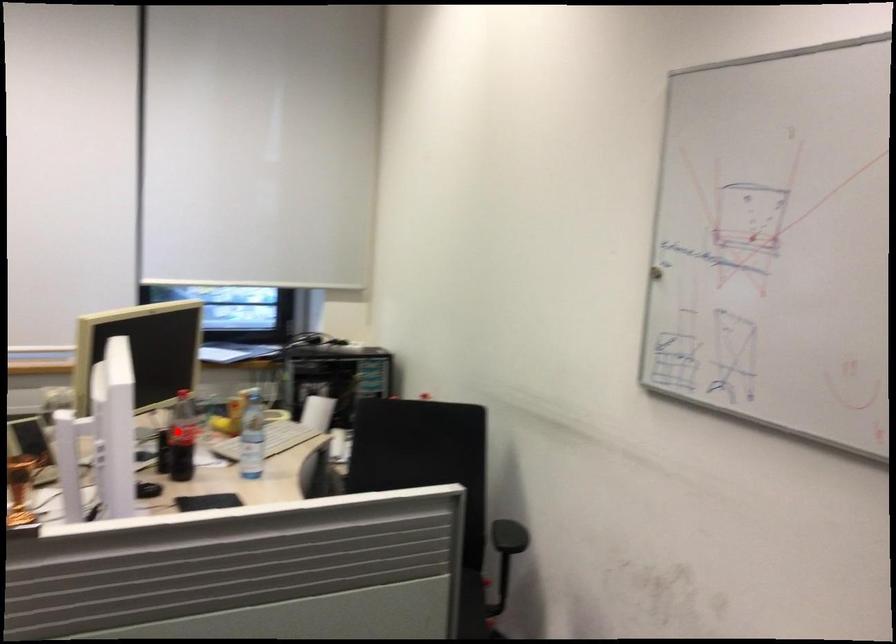
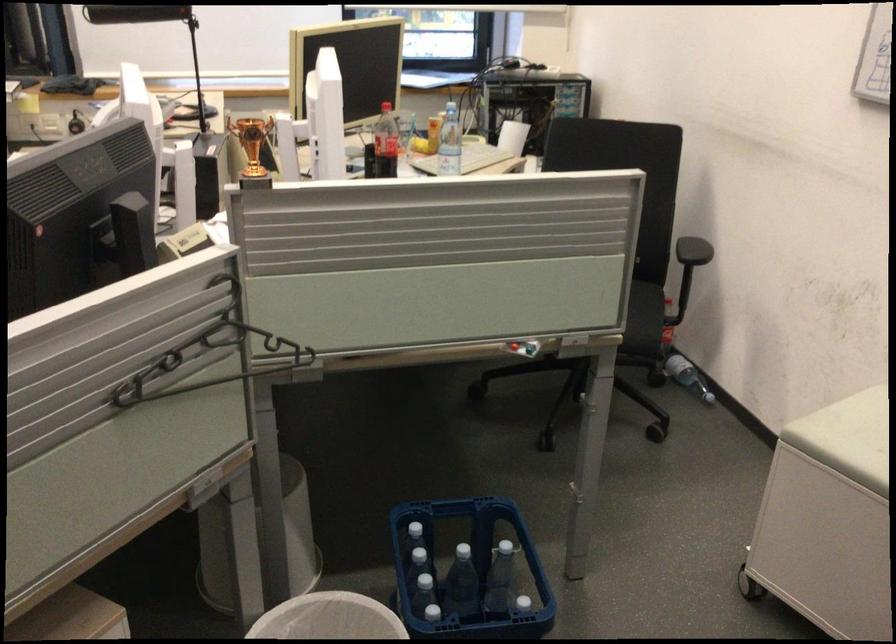
The point at the highlighted location is marked in the first image. Where is the corresponding point in the second image?

(385, 143)